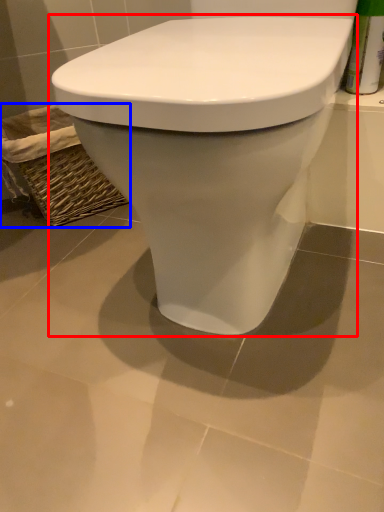
Question: Among these objects, which one is nearest to the camera, toilet (highlighted by a red box) or basket (highlighted by a blue box)?

Choices:
 (A) toilet
 (B) basket

Answer: (A)